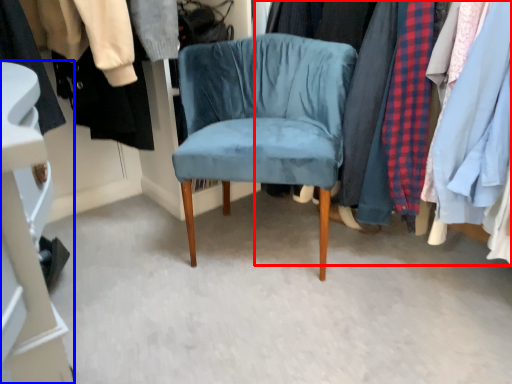
Question: Which point is closer to the camera, closet (highlighted by a red box) or closet (highlighted by a blue box)?

Choices:
 (A) closet
 (B) closet

Answer: (A)